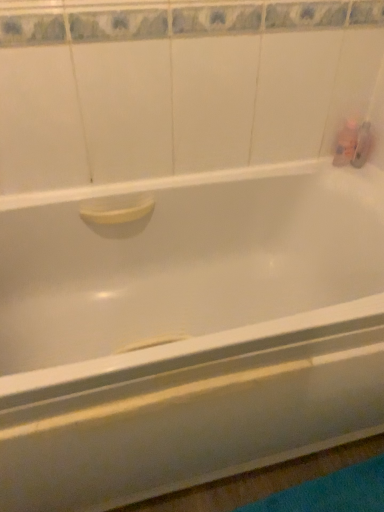
Describe the element at coordinates (362, 145) in the screenshot. The width and height of the screenshot is (384, 512). I see `translucent plastic soap at upper right, which ranks as the second toiletry in left-to-right order` at that location.

What is the approximate width of translucent plastic soap at upper right, which is the 1th toiletry in right-to-left order?

The width of translucent plastic soap at upper right, which is the 1th toiletry in right-to-left order, is 4.79 centimeters.

Locate an element on the screen. The width and height of the screenshot is (384, 512). translucent plastic soap at upper right, which ranks as the second toiletry in left-to-right order is located at coordinates (362, 145).

This screenshot has width=384, height=512. What do you see at coordinates (346, 143) in the screenshot?
I see `translucent plastic bottle at upper right, which is the second toiletry in right-to-left order` at bounding box center [346, 143].

This screenshot has width=384, height=512. I want to click on translucent plastic bottle at upper right, the 1th toiletry viewed from the left, so click(346, 143).

Locate an element on the screen. This screenshot has width=384, height=512. translucent plastic soap at upper right, which ranks as the second toiletry in left-to-right order is located at coordinates (362, 145).

In the image, is translucent plastic soap at upper right, which ranks as the second toiletry in left-to-right order, on the left side or the right side of translucent plastic bottle at upper right, the 1th toiletry viewed from the left?

translucent plastic soap at upper right, which ranks as the second toiletry in left-to-right order, is positioned on translucent plastic bottle at upper right, the 1th toiletry viewed from the left,'s right side.

Is translucent plastic soap at upper right, which is the 1th toiletry in right-to-left order, further to camera compared to translucent plastic bottle at upper right, the 1th toiletry viewed from the left?

Yes.

Considering the points (358, 145) and (339, 135), which point is behind, point (358, 145) or point (339, 135)?

The point (358, 145) is farther.

From the image's perspective, is translucent plastic soap at upper right, which ranks as the second toiletry in left-to-right order, below translucent plastic bottle at upper right, which is the second toiletry in right-to-left order?

No, from the image's perspective, translucent plastic soap at upper right, which ranks as the second toiletry in left-to-right order, is not below translucent plastic bottle at upper right, which is the second toiletry in right-to-left order.

From a real-world perspective, which is physically above, translucent plastic soap at upper right, which is the 1th toiletry in right-to-left order, or translucent plastic bottle at upper right, which is the second toiletry in right-to-left order?

translucent plastic bottle at upper right, which is the second toiletry in right-to-left order, is physically above.

Considering the sizes of objects translucent plastic soap at upper right, which is the 1th toiletry in right-to-left order, and translucent plastic bottle at upper right, which is the second toiletry in right-to-left order, in the image provided, who is wider, translucent plastic soap at upper right, which is the 1th toiletry in right-to-left order, or translucent plastic bottle at upper right, which is the second toiletry in right-to-left order,?

With larger width is translucent plastic bottle at upper right, which is the second toiletry in right-to-left order.

Considering the sizes of translucent plastic soap at upper right, which is the 1th toiletry in right-to-left order, and translucent plastic bottle at upper right, the 1th toiletry viewed from the left, in the image, is translucent plastic soap at upper right, which is the 1th toiletry in right-to-left order, taller or shorter than translucent plastic bottle at upper right, the 1th toiletry viewed from the left,?

translucent plastic soap at upper right, which is the 1th toiletry in right-to-left order, is shorter than translucent plastic bottle at upper right, the 1th toiletry viewed from the left.

Which of these two, translucent plastic soap at upper right, which ranks as the second toiletry in left-to-right order, or translucent plastic bottle at upper right, which is the second toiletry in right-to-left order, is smaller?

translucent plastic soap at upper right, which ranks as the second toiletry in left-to-right order.

Choose the correct answer: Is translucent plastic soap at upper right, which is the 1th toiletry in right-to-left order, inside translucent plastic bottle at upper right, the 1th toiletry viewed from the left, or outside it?

translucent plastic soap at upper right, which is the 1th toiletry in right-to-left order, is not enclosed by translucent plastic bottle at upper right, the 1th toiletry viewed from the left.

Is translucent plastic soap at upper right, which ranks as the second toiletry in left-to-right order, touching translucent plastic bottle at upper right, the 1th toiletry viewed from the left?

Yes, translucent plastic soap at upper right, which ranks as the second toiletry in left-to-right order, is touching translucent plastic bottle at upper right, the 1th toiletry viewed from the left.

Could you tell me if translucent plastic soap at upper right, which is the 1th toiletry in right-to-left order, is facing translucent plastic bottle at upper right, the 1th toiletry viewed from the left?

No, translucent plastic soap at upper right, which is the 1th toiletry in right-to-left order, is not oriented towards translucent plastic bottle at upper right, the 1th toiletry viewed from the left.

Locate an element on the screen. toiletry directly beneath the translucent plastic bottle at upper right, which is the second toiletry in right-to-left order (from a real-world perspective) is located at coordinates (362, 145).

Can you confirm if translucent plastic bottle at upper right, which is the second toiletry in right-to-left order, is positioned to the right of translucent plastic soap at upper right, which ranks as the second toiletry in left-to-right order?

No.

Which object is more forward, translucent plastic bottle at upper right, the 1th toiletry viewed from the left, or translucent plastic soap at upper right, which is the 1th toiletry in right-to-left order?

translucent plastic bottle at upper right, the 1th toiletry viewed from the left, is closer to the camera.

Which point is more distant from viewer, (343, 129) or (365, 138)?

The point (365, 138) is behind.

From the image's perspective, who appears lower, translucent plastic bottle at upper right, the 1th toiletry viewed from the left, or translucent plastic soap at upper right, which ranks as the second toiletry in left-to-right order?

translucent plastic bottle at upper right, the 1th toiletry viewed from the left, is shown below in the image.

From a real-world perspective, is translucent plastic bottle at upper right, which is the second toiletry in right-to-left order, located beneath translucent plastic soap at upper right, which is the 1th toiletry in right-to-left order?

No.

Can you confirm if translucent plastic bottle at upper right, which is the second toiletry in right-to-left order, is thinner than translucent plastic soap at upper right, which ranks as the second toiletry in left-to-right order?

In fact, translucent plastic bottle at upper right, which is the second toiletry in right-to-left order, might be wider than translucent plastic soap at upper right, which ranks as the second toiletry in left-to-right order.

Does translucent plastic bottle at upper right, which is the second toiletry in right-to-left order, have a greater height compared to translucent plastic soap at upper right, which is the 1th toiletry in right-to-left order?

Yes.

Looking at the image, does translucent plastic bottle at upper right, the 1th toiletry viewed from the left, seem bigger or smaller compared to translucent plastic soap at upper right, which is the 1th toiletry in right-to-left order?

In the image, translucent plastic bottle at upper right, the 1th toiletry viewed from the left, appears to be larger than translucent plastic soap at upper right, which is the 1th toiletry in right-to-left order.

Is translucent plastic bottle at upper right, which is the second toiletry in right-to-left order, not within translucent plastic soap at upper right, which ranks as the second toiletry in left-to-right order?

Yes, translucent plastic bottle at upper right, which is the second toiletry in right-to-left order, is located beyond the bounds of translucent plastic soap at upper right, which ranks as the second toiletry in left-to-right order.

Are translucent plastic bottle at upper right, the 1th toiletry viewed from the left, and translucent plastic soap at upper right, which is the 1th toiletry in right-to-left order, far apart?

No, there isn't a large distance between translucent plastic bottle at upper right, the 1th toiletry viewed from the left, and translucent plastic soap at upper right, which is the 1th toiletry in right-to-left order.

Does translucent plastic bottle at upper right, which is the second toiletry in right-to-left order, turn towards translucent plastic soap at upper right, which ranks as the second toiletry in left-to-right order?

No, translucent plastic bottle at upper right, which is the second toiletry in right-to-left order, is not turned towards translucent plastic soap at upper right, which ranks as the second toiletry in left-to-right order.

Measure the distance from translucent plastic bottle at upper right, the 1th toiletry viewed from the left, to translucent plastic soap at upper right, which is the 1th toiletry in right-to-left order.

translucent plastic bottle at upper right, the 1th toiletry viewed from the left, is 1.57 inches from translucent plastic soap at upper right, which is the 1th toiletry in right-to-left order.

What are the coordinates of `toiletry that appears above the translucent plastic soap at upper right, which is the 1th toiletry in right-to-left order (from a real-world perspective)` in the screenshot? It's located at (346, 143).

You are a GUI agent. You are given a task and a screenshot of the screen. Output one action in this format:
    pyautogui.click(x=<x>, y=<y>)
    Task: Click on the toiletry below the translucent plastic soap at upper right, which is the 1th toiletry in right-to-left order (from the image's perspective)
    
    Given the screenshot: What is the action you would take?
    pyautogui.click(x=346, y=143)

Locate an element on the screen. Image resolution: width=384 pixels, height=512 pixels. toiletry that is behind the translucent plastic bottle at upper right, which is the second toiletry in right-to-left order is located at coordinates (362, 145).